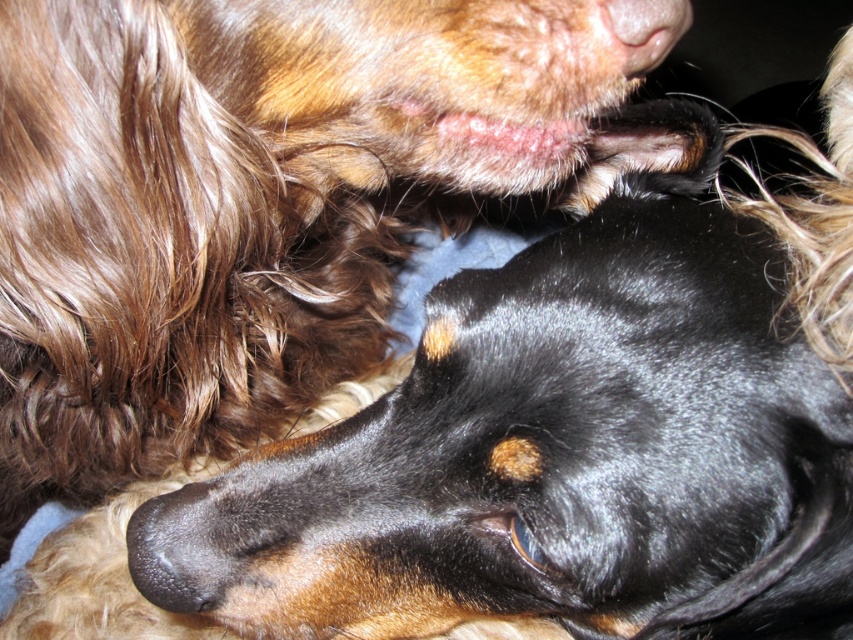
You are a photographer adjusting your camera to focus on two points in the image. The first point is point [409,196] and the second is point [637,68]. Which point is closer to you?

Point [409,196] is closer to you than point [637,68] because it is further to the viewer.

You are standing in front of the two dogs in the image. There is a treat bag placed at point (244,204). Which dog is closest to the treat bag?

The black shiny dog at center is closest to the treat bag placed at point (244,204).

In the scene shown: You are a veterinarian examining two patients in the image. You notice the black shiny dog at center and the pink soft skin at upper center. Which patient is taller?

The black shiny dog at center is much taller than the pink soft skin at upper center.